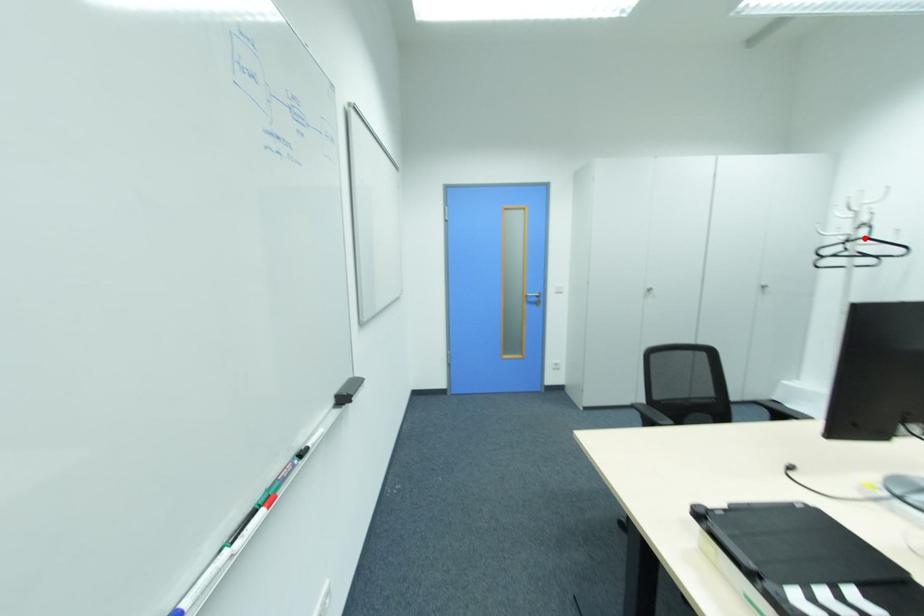
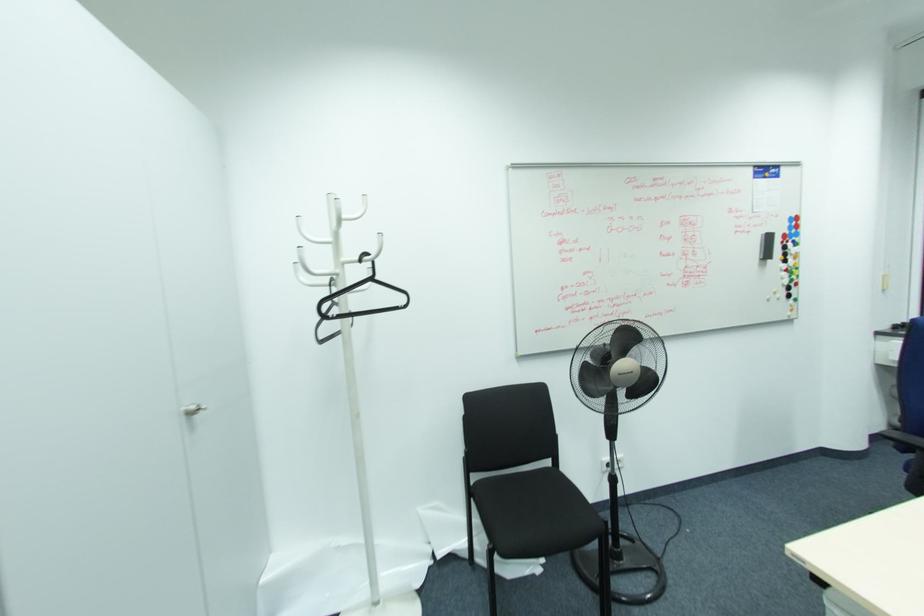
Where in the second image is the point corresponding to the highlighted location from the first image?

(371, 280)